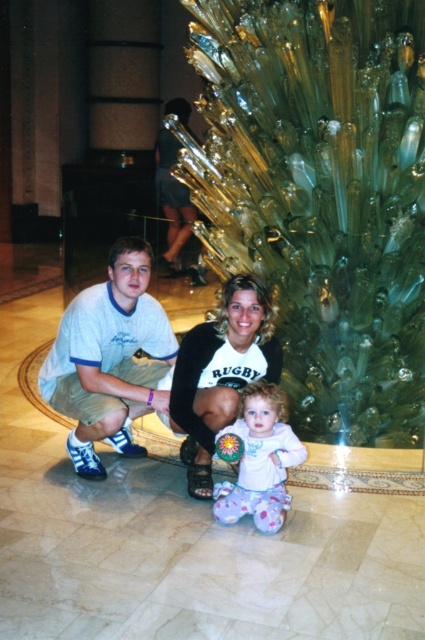
Is white cotton shirt at center wider than white matte sweater at center?

Yes, white cotton shirt at center is wider than white matte sweater at center.

Does white cotton shirt at center appear over white matte sweater at center?

Correct, white cotton shirt at center is located above white matte sweater at center.

Between point (115, 284) and point (221, 349), which one is positioned behind?

Point (115, 284)

Locate an element on the screen. This screenshot has width=425, height=640. white cotton shirt at center is located at coordinates (108, 358).

Who is positioned more to the right, white cotton shirt at center or fluffy white onesie at center?

fluffy white onesie at center

Does white cotton shirt at center have a lesser height compared to fluffy white onesie at center?

Incorrect, white cotton shirt at center's height does not fall short of fluffy white onesie at center's.

Is point (119, 304) positioned behind point (232, 516)?

That is True.

Where is `white cotton shirt at center`? The image size is (425, 640). white cotton shirt at center is located at coordinates (108, 358).

Can you confirm if white matte sweater at center is wider than fluffy white onesie at center?

Indeed, white matte sweater at center has a greater width compared to fluffy white onesie at center.

Is the position of white matte sweater at center less distant than that of fluffy white onesie at center?

No, white matte sweater at center is behind fluffy white onesie at center.

What do you see at coordinates (220, 372) in the screenshot?
I see `white matte sweater at center` at bounding box center [220, 372].

This screenshot has height=640, width=425. What are the coordinates of `white matte sweater at center` in the screenshot? It's located at (220, 372).